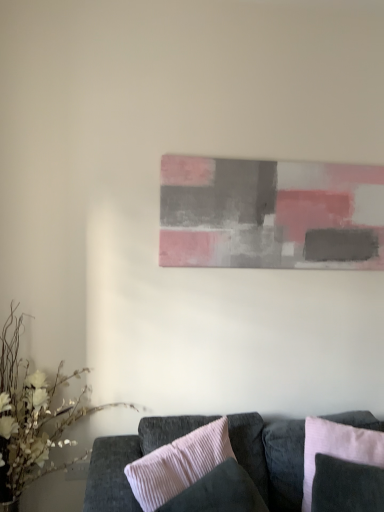
Question: From the image's perspective, does pink corduroy pillow at center, which ranks as the 1th pillow in left-to-right order, appear higher than matte gray painting at center?

Choices:
 (A) no
 (B) yes

Answer: (A)

Question: Is the position of pink corduroy pillow at center, the 2th pillow when ordered from right to left, more distant than that of matte gray painting at center?

Choices:
 (A) no
 (B) yes

Answer: (A)

Question: Is pink corduroy pillow at center, which ranks as the 1th pillow in left-to-right order, not within matte gray painting at center?

Choices:
 (A) no
 (B) yes

Answer: (B)

Question: Does pink corduroy pillow at center, which ranks as the 1th pillow in left-to-right order, have a greater height compared to matte gray painting at center?

Choices:
 (A) yes
 (B) no

Answer: (B)

Question: Is pink corduroy pillow at center, the 2th pillow when ordered from right to left, oriented away from matte gray painting at center?

Choices:
 (A) yes
 (B) no

Answer: (B)

Question: Do you think pink corduroy pillow at center, which ranks as the 1th pillow in left-to-right order, is within pink corduroy pillow at lower right, which is the 2th pillow in left-to-right order, or outside of it?

Choices:
 (A) inside
 (B) outside

Answer: (B)

Question: From a real-world perspective, is pink corduroy pillow at center, which ranks as the 1th pillow in left-to-right order, above or below pink corduroy pillow at lower right, which is the 1th pillow from right to left?

Choices:
 (A) below
 (B) above

Answer: (A)

Question: From their relative heights in the image, would you say pink corduroy pillow at center, the 2th pillow when ordered from right to left, is taller or shorter than pink corduroy pillow at lower right, which is the 2th pillow in left-to-right order?

Choices:
 (A) tall
 (B) short

Answer: (A)

Question: From the image's perspective, is pink corduroy pillow at center, the 2th pillow when ordered from right to left, above or below pink corduroy pillow at lower right, which is the 1th pillow from right to left?

Choices:
 (A) above
 (B) below

Answer: (B)

Question: Would you say matte gray painting at center is inside or outside white matte floral arrangement at lower left?

Choices:
 (A) inside
 (B) outside

Answer: (B)

Question: From their relative heights in the image, would you say matte gray painting at center is taller or shorter than white matte floral arrangement at lower left?

Choices:
 (A) short
 (B) tall

Answer: (A)

Question: From a real-world perspective, is matte gray painting at center positioned above or below white matte floral arrangement at lower left?

Choices:
 (A) below
 (B) above

Answer: (B)

Question: Looking at the image, does matte gray painting at center seem bigger or smaller compared to white matte floral arrangement at lower left?

Choices:
 (A) small
 (B) big

Answer: (A)

Question: In the image, is pink corduroy pillow at center, the 2th pillow when ordered from right to left, positioned in front of or behind velvet dark gray couch at lower center?

Choices:
 (A) front
 (B) behind

Answer: (A)

Question: From the image's perspective, is pink corduroy pillow at center, which ranks as the 1th pillow in left-to-right order, located above or below velvet dark gray couch at lower center?

Choices:
 (A) above
 (B) below

Answer: (A)